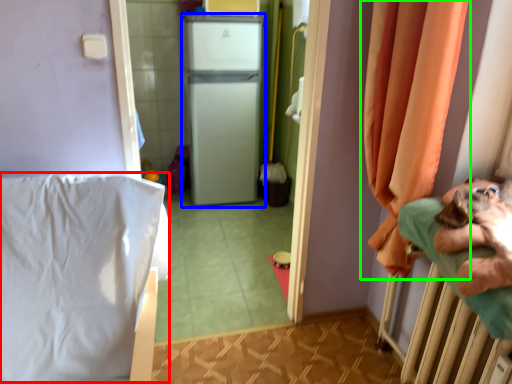
Question: Based on their relative distances, which object is nearer to sheet (highlighted by a red box)? Choose from appliance (highlighted by a blue box) and curtain (highlighted by a green box).

Choices:
 (A) appliance
 (B) curtain

Answer: (B)